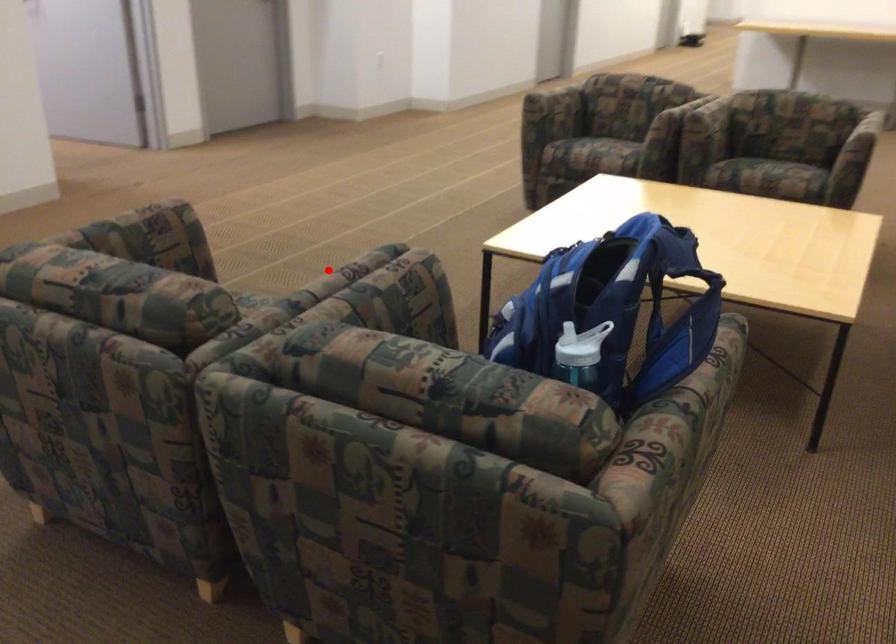
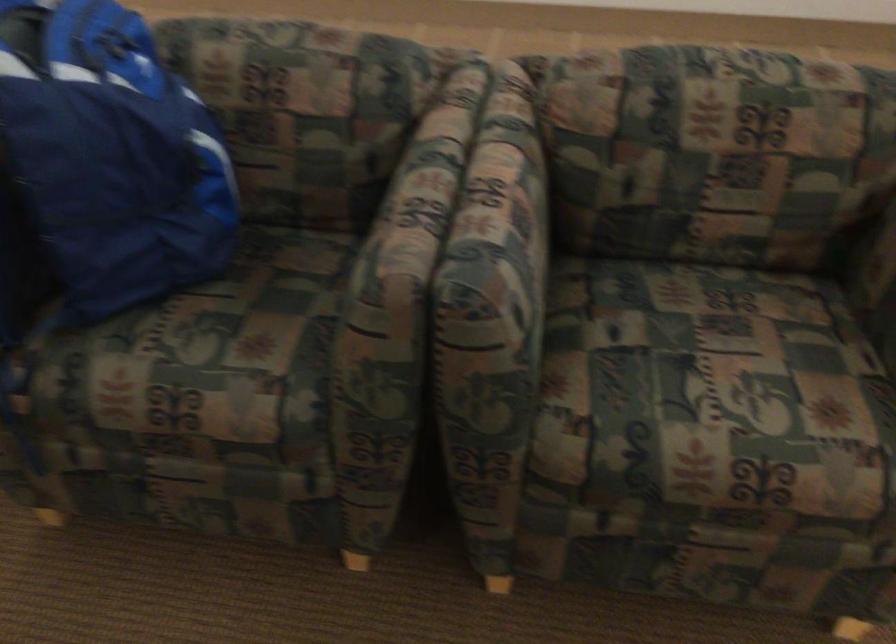
Question: I am providing you with two images of the same scene from different viewpoints. A red point is shown in image1. For the corresponding object point in image2, is it positioned nearer or farther from the camera?

Choices:
 (A) Nearer
 (B) Farther

Answer: (A)